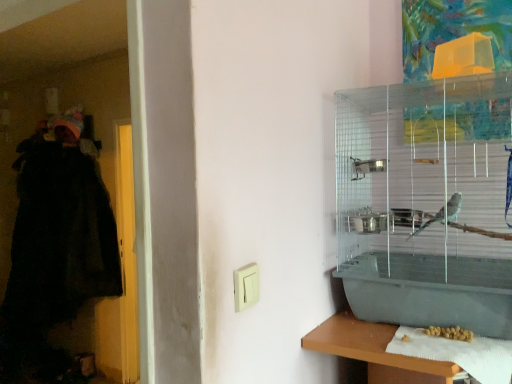
This screenshot has width=512, height=384. Identify the location of free space in front of yellow matte seeds at lower right. (466, 354).